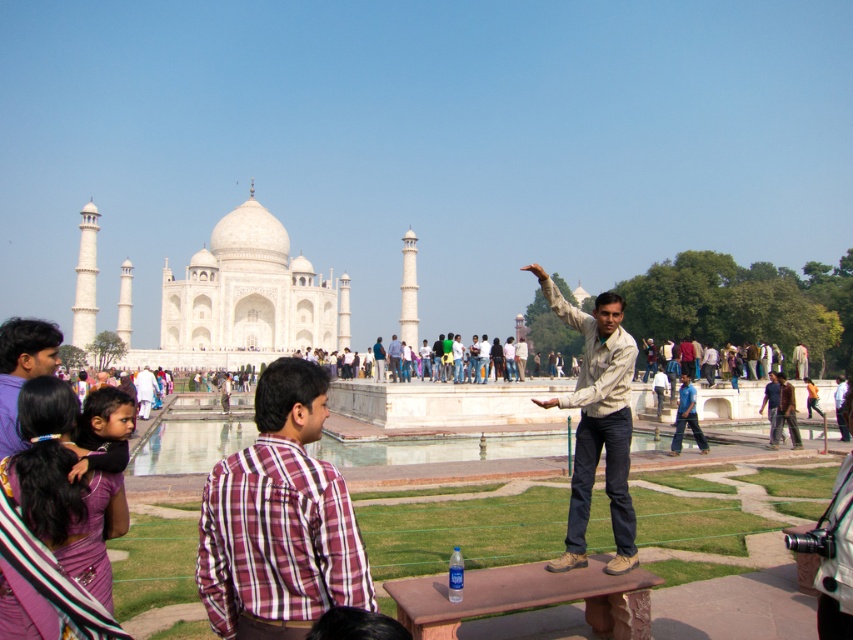
Which is behind, point (106, 588) or point (393, 353)?

The point (393, 353) is behind.

Does purple silk saree at lower left have a smaller size compared to light brown shirt at center?

Actually, purple silk saree at lower left might be larger than light brown shirt at center.

Measure the distance between point (35, 417) and camera.

They are 259.11 feet apart.

Locate an element on the screen. The width and height of the screenshot is (853, 640). purple silk saree at lower left is located at coordinates (54, 525).

Is point (3, 529) farther from viewer compared to point (3, 442)?

No, it is in front of (3, 442).

You are a GUI agent. You are given a task and a screenshot of the screen. Output one action in this format:
    pyautogui.click(x=<x>, y=<y>)
    Task: Click on the purple silk saree at lower left
    This screenshot has width=853, height=640.
    Given the screenshot: What is the action you would take?
    pyautogui.click(x=54, y=525)

Does light purple shirt at lower left have a lesser height compared to light brown shirt at center?

No, light purple shirt at lower left is not shorter than light brown shirt at center.

Which is above, light purple shirt at lower left or light brown shirt at center?

light brown shirt at center is higher up.

The height and width of the screenshot is (640, 853). What are the coordinates of `light purple shirt at lower left` in the screenshot? It's located at (22, 369).

Locate an element on the screen. light purple shirt at lower left is located at coordinates point(22,369).